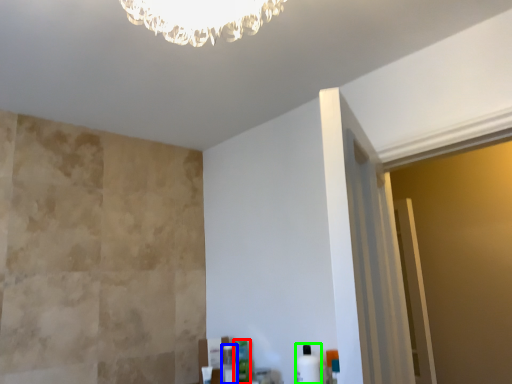
Question: Which object is positioned closest to toiletry (highlighted by a red box)? Select from toiletry (highlighted by a blue box) and toiletry (highlighted by a green box).

Choices:
 (A) toiletry
 (B) toiletry

Answer: (A)